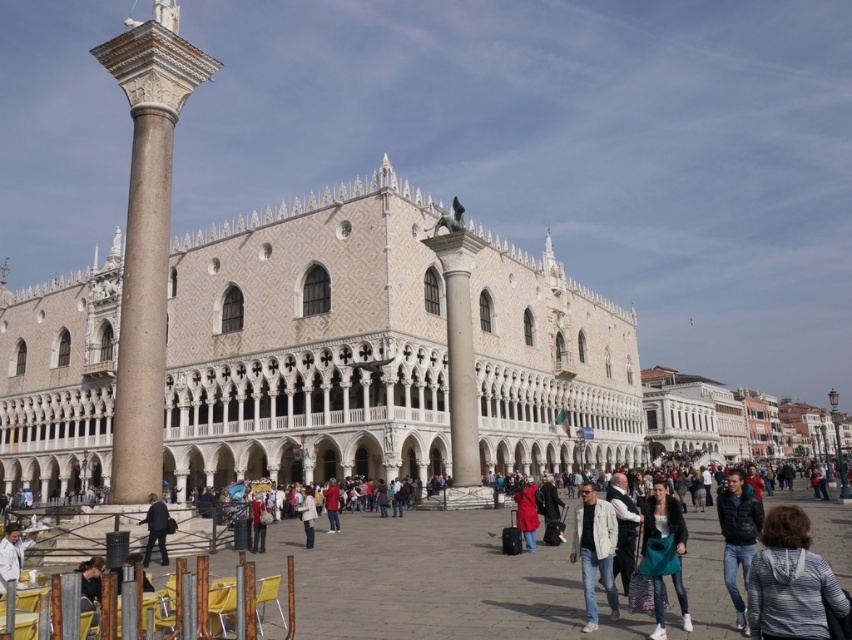
Question: Does smooth stone column at left appear over red matte jacket at center?

Choices:
 (A) yes
 (B) no

Answer: (A)

Question: Which is farther from the matte red coat at center?

Choices:
 (A) smooth stone column at left
 (B) gray hoodie at lower right
 (C) teal fabric bag at lower right

Answer: (A)

Question: Is smooth stone column at center further to the viewer compared to red matte jacket at center?

Choices:
 (A) yes
 (B) no

Answer: (A)

Question: Is gray hoodie at lower right below leather jacket at lower right?

Choices:
 (A) no
 (B) yes

Answer: (B)

Question: Considering the real-world distances, which object is closest to the teal fabric bag at lower right?

Choices:
 (A) red matte jacket at center
 (B) white matte jacket at center
 (C) gray hoodie at lower right

Answer: (C)

Question: Estimate the real-world distances between objects in this image. Which object is farther from the light beige leather jacket at lower right?

Choices:
 (A) white textured stone building at center
 (B) gray hoodie at lower right
 (C) matte red coat at center
 (D) leather jacket at lower right

Answer: (A)